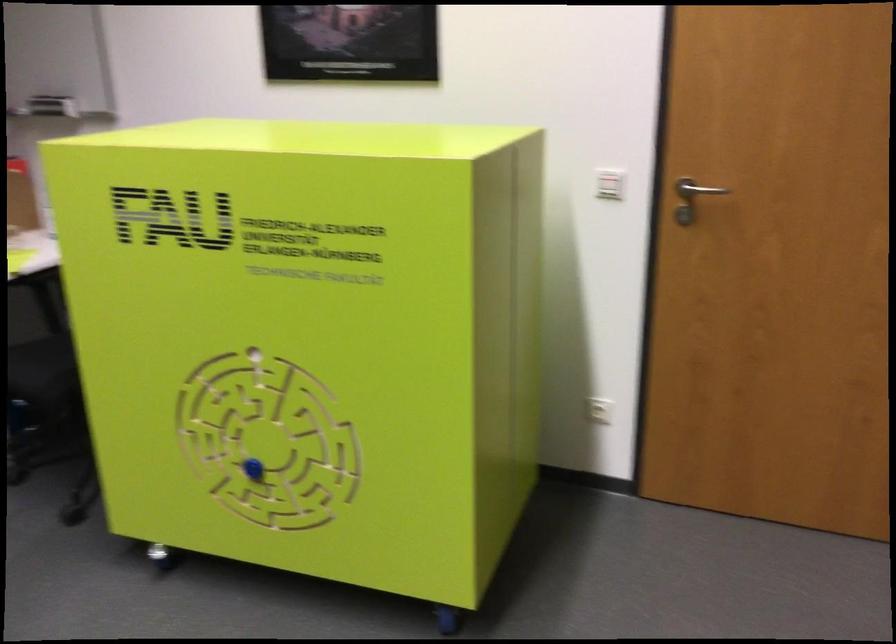
Locate an element on the screen. The height and width of the screenshot is (644, 896). silver door handle is located at coordinates (694, 190).